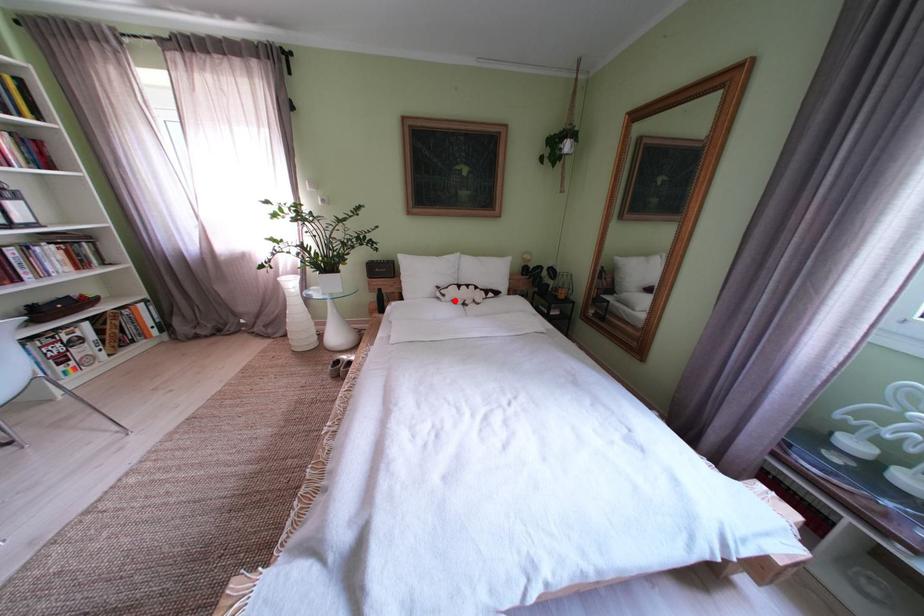
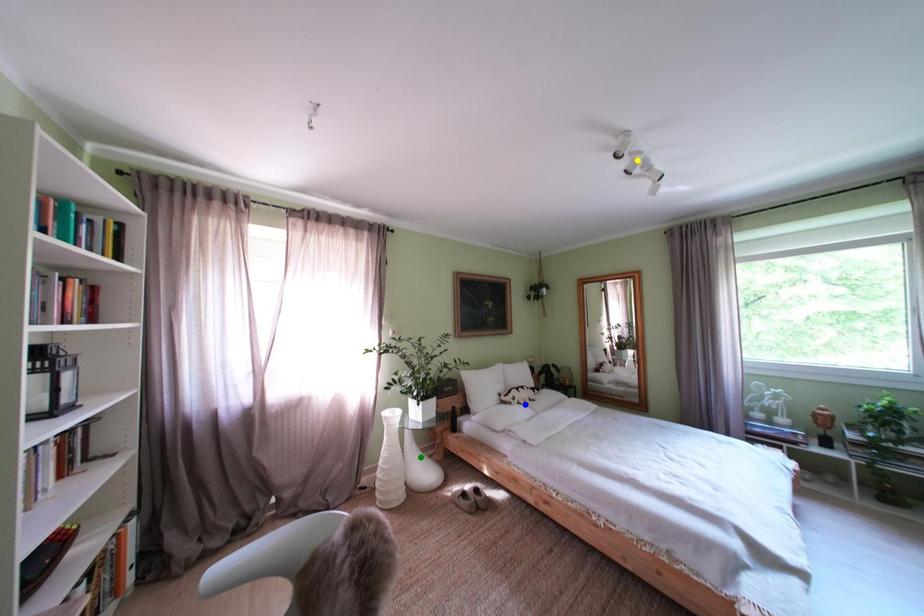
Question: I am providing you with two images of the same scene from different viewpoints. A red point is marked on the first image. You are given multiple points on the second image. Which mark in image 2 goes with the point in image 1?

Choices:
 (A) blue point
 (B) yellow point
 (C) green point

Answer: (A)